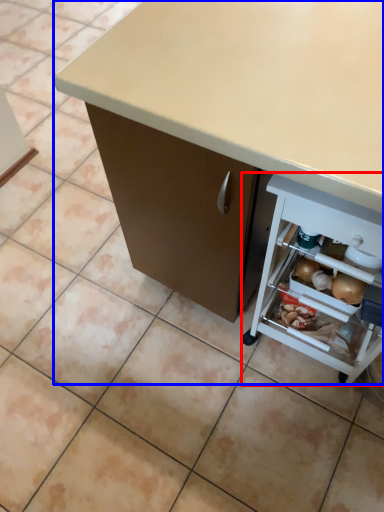
Question: Among these objects, which one is farthest to the camera, shelf (highlighted by a red box) or desk (highlighted by a blue box)?

Choices:
 (A) shelf
 (B) desk

Answer: (A)